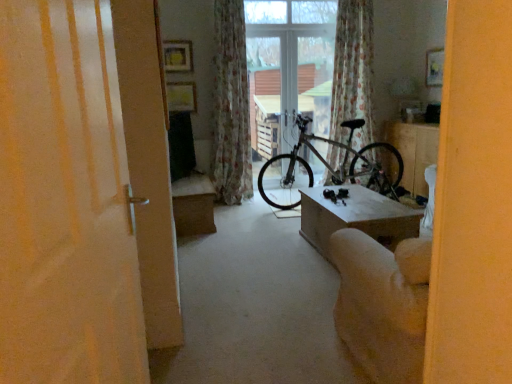
Question: Is silver metallic bicycle at center smaller than beige fabric armchair at lower right?

Choices:
 (A) yes
 (B) no

Answer: (B)

Question: Can you confirm if silver metallic bicycle at center is shorter than beige fabric armchair at lower right?

Choices:
 (A) no
 (B) yes

Answer: (A)

Question: Is silver metallic bicycle at center looking in the opposite direction of beige fabric armchair at lower right?

Choices:
 (A) no
 (B) yes

Answer: (A)

Question: Considering the relative positions of silver metallic bicycle at center and beige fabric armchair at lower right in the image provided, is silver metallic bicycle at center to the left of beige fabric armchair at lower right from the viewer's perspective?

Choices:
 (A) no
 (B) yes

Answer: (A)

Question: Can you confirm if silver metallic bicycle at center is thinner than beige fabric armchair at lower right?

Choices:
 (A) no
 (B) yes

Answer: (A)

Question: Is silver metallic bicycle at center taller than beige fabric armchair at lower right?

Choices:
 (A) yes
 (B) no

Answer: (A)

Question: Does beige fabric armchair at lower right turn towards white glossy table at center, the second table in the front-to-back sequence?

Choices:
 (A) yes
 (B) no

Answer: (B)

Question: Is beige fabric armchair at lower right positioned before white glossy table at center, the 1th table viewed from the back?

Choices:
 (A) no
 (B) yes

Answer: (B)

Question: Is beige fabric armchair at lower right outside white glossy table at center, the 1th table viewed from the back?

Choices:
 (A) yes
 (B) no

Answer: (A)

Question: Is beige fabric armchair at lower right smaller than white glossy table at center, the second table in the left-to-right sequence?

Choices:
 (A) yes
 (B) no

Answer: (B)

Question: Is beige fabric armchair at lower right to the right of white glossy table at center, positioned as the 1th table in right-to-left order, from the viewer's perspective?

Choices:
 (A) yes
 (B) no

Answer: (B)

Question: From the image's perspective, is beige fabric armchair at lower right located above white glossy table at center, the second table in the front-to-back sequence?

Choices:
 (A) no
 (B) yes

Answer: (A)

Question: From the image's perspective, is floral fabric curtain at upper center, the first curtain viewed from the right, on top of light brown wooden table at center, which is the 1th table in front-to-back order?

Choices:
 (A) no
 (B) yes

Answer: (B)